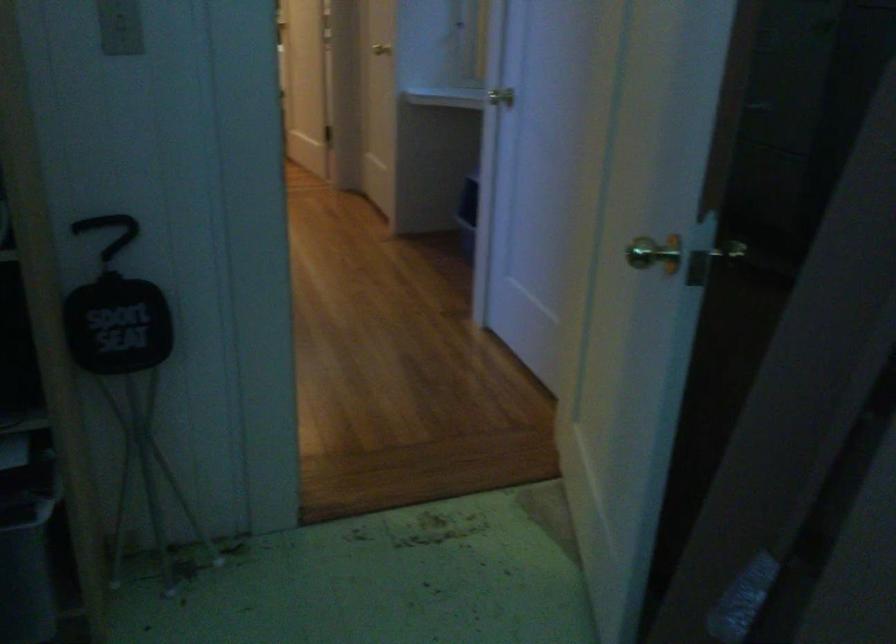
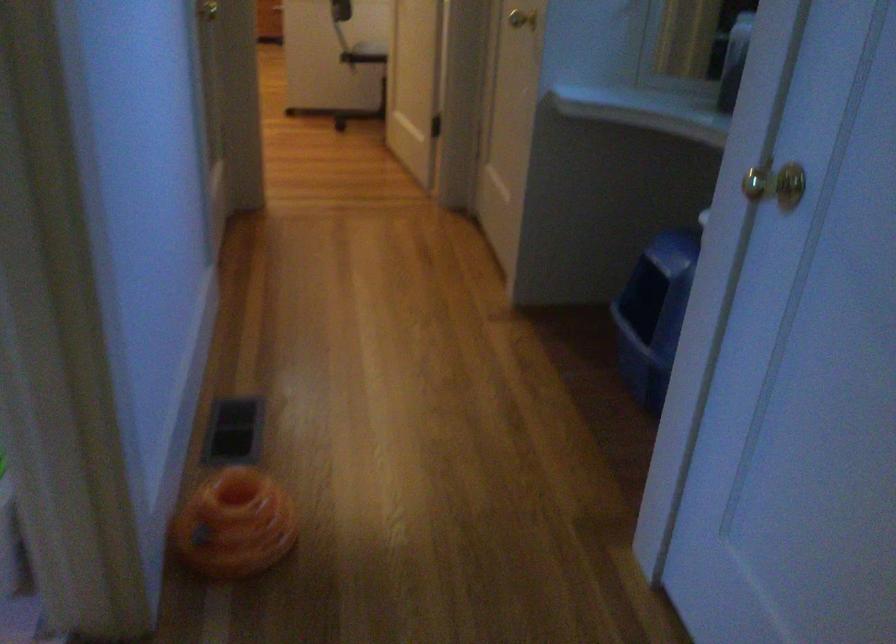
Question: What movement of the cameraman would produce the second image?

Choices:
 (A) Left
 (B) Right
 (C) Forward
 (D) Backward

Answer: (C)